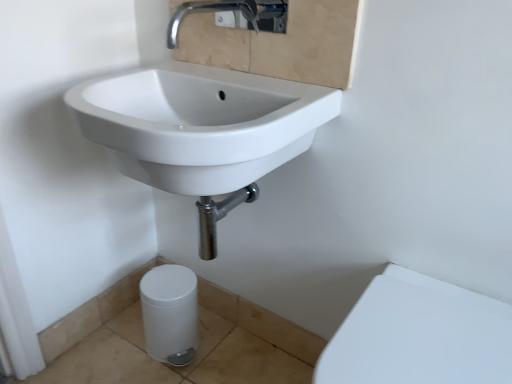
The height and width of the screenshot is (384, 512). Describe the element at coordinates (170, 313) in the screenshot. I see `white glossy trash can at lower left, arranged as the 2th porcelain when viewed from the front` at that location.

How much space does white glossy porcelain at lower right, which is the first porcelain in right-to-left order, occupy vertically?

17.34 inches.

Where is `white glossy sink at upper left`? This screenshot has width=512, height=384. white glossy sink at upper left is located at coordinates (201, 131).

At what (x,y) coordinates should I click in order to perform the action: click on white glossy trash can at lower left, positioned as the 2th porcelain in right-to-left order. Please return your answer as a coordinate pair (x, y). This screenshot has height=384, width=512. Looking at the image, I should click on (170, 313).

Considering the points (227, 82) and (173, 23), which point is behind, point (227, 82) or point (173, 23)?

Positioned behind is point (173, 23).

Looking at this image, from the image's perspective, between white glossy sink at upper left and chrome metallic faucet at upper center, which one is located above?

chrome metallic faucet at upper center.

Is white glossy sink at upper left inside the boundaries of chrome metallic faucet at upper center, or outside?

white glossy sink at upper left is located beyond the bounds of chrome metallic faucet at upper center.

Could you tell me if white glossy sink at upper left is facing chrome metallic faucet at upper center?

No, white glossy sink at upper left is not aimed at chrome metallic faucet at upper center.

Which object is wider, white glossy trash can at lower left, which ranks as the first porcelain in back-to-front order, or white glossy sink at upper left?

Wider between the two is white glossy sink at upper left.

Is white glossy trash can at lower left, arranged as the 2th porcelain when viewed from the front, smaller than white glossy sink at upper left?

Yes, white glossy trash can at lower left, arranged as the 2th porcelain when viewed from the front, is smaller than white glossy sink at upper left.

Based on their positions, is white glossy trash can at lower left, the first porcelain viewed from the left, located to the left or right of white glossy sink at upper left?

Clearly, white glossy trash can at lower left, the first porcelain viewed from the left, is on the left of white glossy sink at upper left in the image.

Is white glossy trash can at lower left, the first porcelain viewed from the left, beside white glossy sink at upper left?

white glossy trash can at lower left, the first porcelain viewed from the left, and white glossy sink at upper left are clearly separated.

Does point (258, 5) come behind point (192, 279)?

Yes, it is behind point (192, 279).

Are chrome metallic faucet at upper center and white glossy trash can at lower left, the first porcelain viewed from the left, making contact?

No, chrome metallic faucet at upper center is not touching white glossy trash can at lower left, the first porcelain viewed from the left.

From the image's perspective, is chrome metallic faucet at upper center located above or below white glossy trash can at lower left, arranged as the 2th porcelain when viewed from the front?

Based on their image positions, chrome metallic faucet at upper center is located above white glossy trash can at lower left, arranged as the 2th porcelain when viewed from the front.

Are white glossy trash can at lower left, arranged as the 2th porcelain when viewed from the front, and chrome metallic faucet at upper center beside each other?

No, white glossy trash can at lower left, arranged as the 2th porcelain when viewed from the front, is not next to chrome metallic faucet at upper center.

Is white glossy trash can at lower left, which ranks as the first porcelain in back-to-front order, outside of chrome metallic faucet at upper center?

Yes, white glossy trash can at lower left, which ranks as the first porcelain in back-to-front order, is outside of chrome metallic faucet at upper center.

From the picture: Is white glossy trash can at lower left, the first porcelain viewed from the left, thinner than chrome metallic faucet at upper center?

Yes.

Is white glossy sink at upper left positioned far away from white glossy porcelain at lower right, the second porcelain positioned from the back?

white glossy sink at upper left is near white glossy porcelain at lower right, the second porcelain positioned from the back, not far away.

Is point (271, 156) farther from camera compared to point (383, 325)?

Yes, point (271, 156) is farther from viewer.

From the picture: Is white glossy porcelain at lower right, the second porcelain positioned from the back, at the back of white glossy sink at upper left?

That's not correct — white glossy sink at upper left is not looking away from white glossy porcelain at lower right, the second porcelain positioned from the back.

From a real-world perspective, does white glossy sink at upper left sit lower than white glossy porcelain at lower right, which is the first porcelain in right-to-left order?

No, from a real-world perspective, white glossy sink at upper left is not under white glossy porcelain at lower right, which is the first porcelain in right-to-left order.

Could you tell me if white glossy trash can at lower left, which ranks as the first porcelain in back-to-front order, is facing white glossy porcelain at lower right, the second porcelain positioned from the back?

No, white glossy trash can at lower left, which ranks as the first porcelain in back-to-front order, is not oriented towards white glossy porcelain at lower right, the second porcelain positioned from the back.

Can you tell me how much white glossy trash can at lower left, arranged as the 2th porcelain when viewed from the front, and white glossy porcelain at lower right, which is the first porcelain in right-to-left order, differ in facing direction?

The facing directions of white glossy trash can at lower left, arranged as the 2th porcelain when viewed from the front, and white glossy porcelain at lower right, which is the first porcelain in right-to-left order, are 1.62 degrees apart.

Is white glossy trash can at lower left, which ranks as the first porcelain in back-to-front order, surrounding white glossy porcelain at lower right, which is the first porcelain in right-to-left order?

No, white glossy porcelain at lower right, which is the first porcelain in right-to-left order, is located outside of white glossy trash can at lower left, which ranks as the first porcelain in back-to-front order.

Based on the photo, is white glossy trash can at lower left, arranged as the 2th porcelain when viewed from the front, touching white glossy porcelain at lower right, arranged as the 2th porcelain when viewed from the left?

white glossy trash can at lower left, arranged as the 2th porcelain when viewed from the front, is not next to white glossy porcelain at lower right, arranged as the 2th porcelain when viewed from the left, and they're not touching.

Considering the sizes of white glossy porcelain at lower right, the second porcelain positioned from the back, and white glossy trash can at lower left, arranged as the 2th porcelain when viewed from the front, in the image, is white glossy porcelain at lower right, the second porcelain positioned from the back, bigger or smaller than white glossy trash can at lower left, arranged as the 2th porcelain when viewed from the front,?

white glossy porcelain at lower right, the second porcelain positioned from the back, is bigger than white glossy trash can at lower left, arranged as the 2th porcelain when viewed from the front.

Which object is positioned more to the left, white glossy porcelain at lower right, arranged as the 2th porcelain when viewed from the left, or white glossy trash can at lower left, positioned as the 2th porcelain in right-to-left order?

white glossy trash can at lower left, positioned as the 2th porcelain in right-to-left order, is more to the left.

Is white glossy porcelain at lower right, marked as the first porcelain in a front-to-back arrangement, facing away from white glossy trash can at lower left, positioned as the 2th porcelain in right-to-left order?

white glossy porcelain at lower right, marked as the first porcelain in a front-to-back arrangement, does not have its back to white glossy trash can at lower left, positioned as the 2th porcelain in right-to-left order.

Would you say white glossy porcelain at lower right, the second porcelain positioned from the back, contains white glossy trash can at lower left, positioned as the 2th porcelain in right-to-left order?

No, white glossy trash can at lower left, positioned as the 2th porcelain in right-to-left order, is not a part of white glossy porcelain at lower right, the second porcelain positioned from the back.

You are a GUI agent. You are given a task and a screenshot of the screen. Output one action in this format:
    pyautogui.click(x=<x>, y=<y>)
    Task: Click on the tap behind the white glossy sink at upper left
    
    Given the screenshot: What is the action you would take?
    pyautogui.click(x=234, y=15)

Locate an element on the screen. Image resolution: width=512 pixels, height=384 pixels. sink above the white glossy trash can at lower left, positioned as the 2th porcelain in right-to-left order (from the image's perspective) is located at coordinates (201, 131).

Which object lies further to the anchor point chrome metallic faucet at upper center, white glossy sink at upper left or white glossy trash can at lower left, which ranks as the first porcelain in back-to-front order?

white glossy trash can at lower left, which ranks as the first porcelain in back-to-front order, is further to chrome metallic faucet at upper center.

Estimate the real-world distances between objects in this image. Which object is closer to white glossy porcelain at lower right, which is the first porcelain in right-to-left order, white glossy sink at upper left or chrome metallic faucet at upper center?

Among the two, white glossy sink at upper left is located nearer to white glossy porcelain at lower right, which is the first porcelain in right-to-left order.

From the image, which object appears to be nearer to white glossy porcelain at lower right, which is the first porcelain in right-to-left order, white glossy trash can at lower left, the first porcelain viewed from the left, or white glossy sink at upper left?

white glossy sink at upper left is positioned closer to the anchor white glossy porcelain at lower right, which is the first porcelain in right-to-left order.

Considering their positions, is white glossy sink at upper left positioned closer to white glossy trash can at lower left, the first porcelain viewed from the left, than chrome metallic faucet at upper center?

white glossy sink at upper left is closer to white glossy trash can at lower left, the first porcelain viewed from the left.

In the scene shown: When comparing their distances from white glossy trash can at lower left, which ranks as the first porcelain in back-to-front order, does white glossy sink at upper left or white glossy porcelain at lower right, which is the first porcelain in right-to-left order, seem further?

white glossy porcelain at lower right, which is the first porcelain in right-to-left order, is further to white glossy trash can at lower left, which ranks as the first porcelain in back-to-front order.

From the image, which object appears to be farther from chrome metallic faucet at upper center, white glossy trash can at lower left, positioned as the 2th porcelain in right-to-left order, or white glossy porcelain at lower right, which is the first porcelain in right-to-left order?

Among the two, white glossy trash can at lower left, positioned as the 2th porcelain in right-to-left order, is located further to chrome metallic faucet at upper center.

Which object lies nearer to the anchor point chrome metallic faucet at upper center, white glossy trash can at lower left, which ranks as the first porcelain in back-to-front order, or white glossy sink at upper left?

Among the two, white glossy sink at upper left is located nearer to chrome metallic faucet at upper center.

When comparing their distances from white glossy porcelain at lower right, marked as the first porcelain in a front-to-back arrangement, does white glossy sink at upper left or white glossy trash can at lower left, arranged as the 2th porcelain when viewed from the front, seem further?

white glossy trash can at lower left, arranged as the 2th porcelain when viewed from the front, is positioned further to the anchor white glossy porcelain at lower right, marked as the first porcelain in a front-to-back arrangement.

The image size is (512, 384). Identify the location of porcelain between chrome metallic faucet at upper center and white glossy porcelain at lower right, the second porcelain positioned from the back, in the vertical direction. (170, 313).

Where is `sink between chrome metallic faucet at upper center and white glossy porcelain at lower right, which is the first porcelain in right-to-left order, vertically`? sink between chrome metallic faucet at upper center and white glossy porcelain at lower right, which is the first porcelain in right-to-left order, vertically is located at coordinates (201, 131).

Where is `sink between chrome metallic faucet at upper center and white glossy trash can at lower left, positioned as the 2th porcelain in right-to-left order, in the up-down direction`? The height and width of the screenshot is (384, 512). sink between chrome metallic faucet at upper center and white glossy trash can at lower left, positioned as the 2th porcelain in right-to-left order, in the up-down direction is located at coordinates (201, 131).

Find the location of a particular element. sink between white glossy porcelain at lower right, arranged as the 2th porcelain when viewed from the left, and white glossy trash can at lower left, arranged as the 2th porcelain when viewed from the front, in the front-back direction is located at coordinates (201, 131).